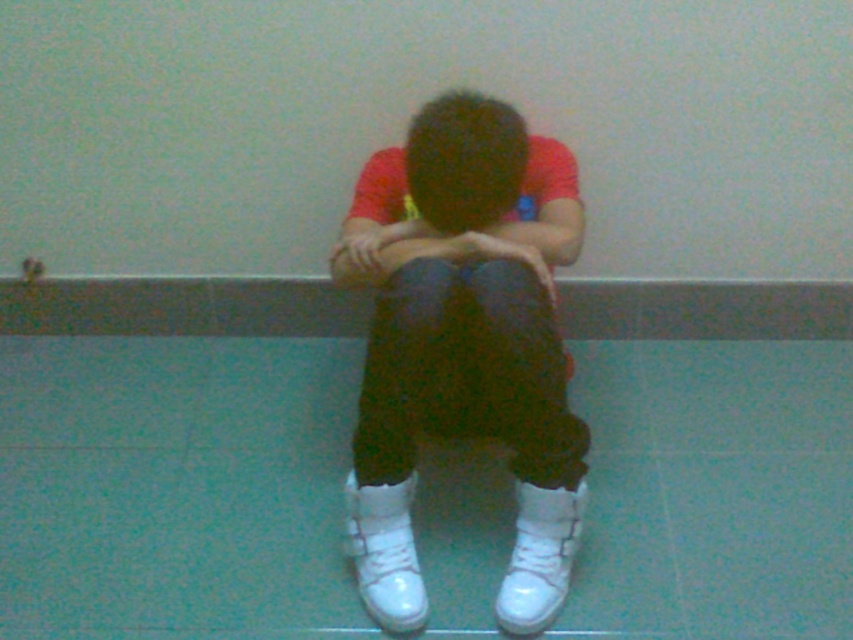
This screenshot has width=853, height=640. What do you see at coordinates (468, 349) in the screenshot? I see `white leather shoes at center` at bounding box center [468, 349].

Which is behind, point (521, 392) or point (482, 166)?

Point (482, 166)

The width and height of the screenshot is (853, 640). I want to click on white leather shoes at center, so click(468, 349).

Does white leather shoes at center have a larger size compared to matte white hand at center?

Indeed, white leather shoes at center has a larger size compared to matte white hand at center.

Is white leather shoes at center wider than matte white hand at center?

Indeed, white leather shoes at center has a greater width compared to matte white hand at center.

Image resolution: width=853 pixels, height=640 pixels. Describe the element at coordinates (468, 349) in the screenshot. I see `white leather shoes at center` at that location.

Identify the location of white leather shoes at center. The image size is (853, 640). (468, 349).

Who is more forward, (503, 179) or (372, 236)?

Point (503, 179) is in front.

You are a GUI agent. You are given a task and a screenshot of the screen. Output one action in this format:
    pyautogui.click(x=<x>, y=<y>)
    Task: Click on the dark brown hair at center
    The image size is (853, 640).
    Given the screenshot: What is the action you would take?
    pyautogui.click(x=463, y=161)